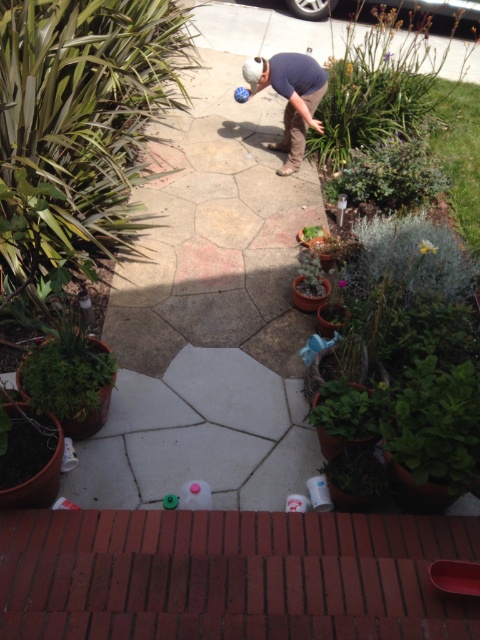
Question: Is green leafy plant at upper right behind matte blue shirt at center?

Choices:
 (A) yes
 (B) no

Answer: (A)

Question: Which point is farther to the camera?

Choices:
 (A) matte blue shirt at center
 (B) purple matte flower at center
 (C) yellow matte flower at center

Answer: (A)

Question: Is matte blue shirt at center thinner than purple matte flower at center?

Choices:
 (A) no
 (B) yes

Answer: (A)

Question: Based on their relative distances, which object is farther from the matte blue shirt at center?

Choices:
 (A) green leafy plant at upper right
 (B) purple matte flower at upper center
 (C) purple matte flower at center

Answer: (C)

Question: Can you confirm if matte blue shirt at center is positioned to the right of yellow matte flower at center?

Choices:
 (A) yes
 (B) no

Answer: (B)

Question: Which object is closer to the camera taking this photo?

Choices:
 (A) yellow matte flower at center
 (B) purple matte flower at upper center
 (C) green leafy plant at upper right

Answer: (A)